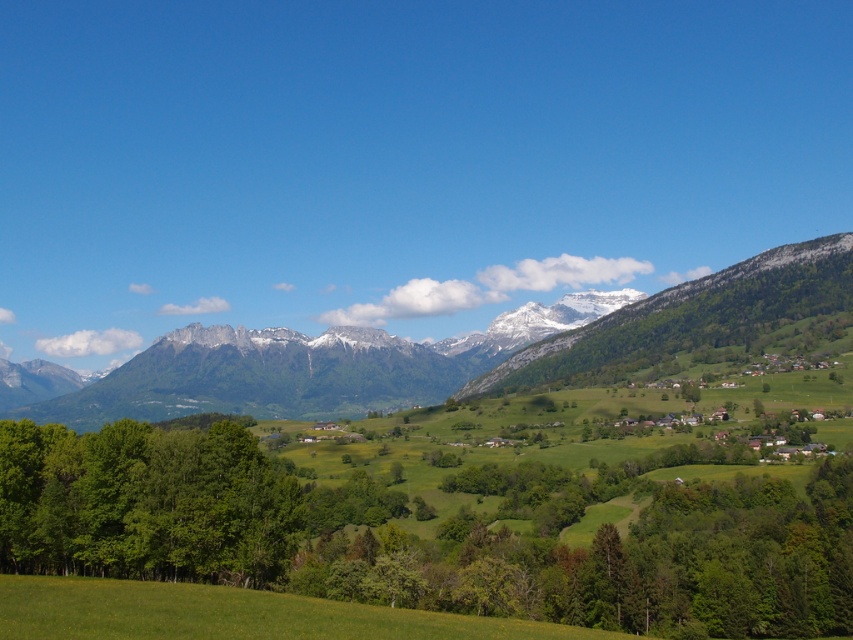
Question: Is green grassy mountain range at upper center bigger than green leafy trees at left?

Choices:
 (A) yes
 (B) no

Answer: (A)

Question: Which of the following is the farthest from the observer?

Choices:
 (A) green grassy mountain range at upper center
 (B) green leafy trees at left

Answer: (A)

Question: Which point is farther from the camera taking this photo?

Choices:
 (A) (514, 364)
 (B) (125, 500)

Answer: (A)

Question: Can you confirm if green grassy mountain range at upper center is thinner than green leafy trees at left?

Choices:
 (A) yes
 (B) no

Answer: (B)

Question: Which point is farther from the camera taking this photo?

Choices:
 (A) (97, 428)
 (B) (3, 458)

Answer: (A)

Question: Is green grassy mountain range at upper center thinner than green leafy trees at left?

Choices:
 (A) yes
 (B) no

Answer: (B)